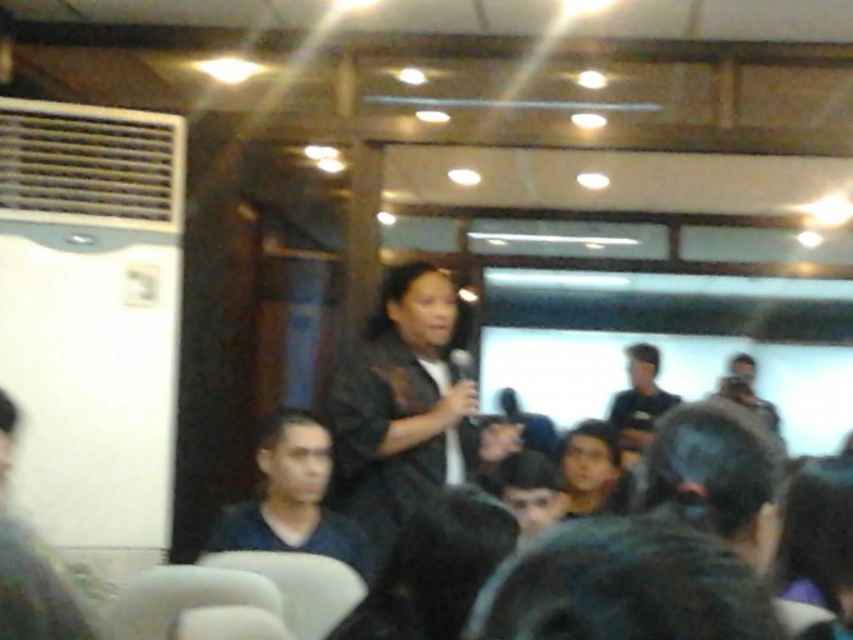
You are organizing a presentation and need to arrange name tags for the two speakers. The dark blue shirt at lower left and the dark gray shirt at center are both presenters. Which presenter should you give a larger name tag to based on their clothing size?

The dark gray shirt at center requires a larger name tag because it is thicker than the dark blue shirt at lower left.

You are an event planner trying to set up a microphone stand between the black matte dress at center and the dark gray shirt at center. The stand requires at least 2 meters of space between them. Can you place it there?

The black matte dress at center and dark gray shirt at center are 2.13 meters apart from each other, so yes, the microphone stand can be placed between them as the distance is sufficient.

You are an attendee at the presentation and want to see both the dark blue shirt at lower left and the dark gray shirt at center clearly. However, the image is blurry. Which shirt is more likely to be in focus?

The dark blue shirt at lower left is positioned over the dark gray shirt at center, so it is more likely to be in focus as it is closer to the camera.